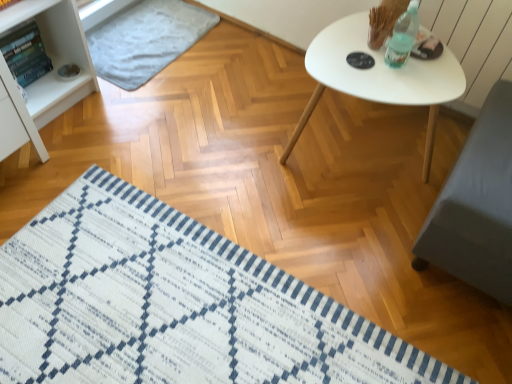
Question: Is white woven mat at lower left, the 2th mat when ordered from top to bottom, positioned behind white matte table at upper right?

Choices:
 (A) yes
 (B) no

Answer: (B)

Question: Can you confirm if white woven mat at lower left, the 2th mat when ordered from top to bottom, is positioned to the right of white matte table at upper right?

Choices:
 (A) no
 (B) yes

Answer: (A)

Question: Does white woven mat at lower left, the 2th mat when ordered from top to bottom, turn towards white matte table at upper right?

Choices:
 (A) yes
 (B) no

Answer: (B)

Question: Would you consider white woven mat at lower left, marked as the 2th mat in a back-to-front arrangement, to be distant from white matte table at upper right?

Choices:
 (A) no
 (B) yes

Answer: (A)

Question: From a real-world perspective, is white woven mat at lower left, the first mat when ordered from front to back, beneath white matte table at upper right?

Choices:
 (A) no
 (B) yes

Answer: (B)

Question: Looking at their shapes, would you say white woven mat at lower left, marked as the 2th mat in a back-to-front arrangement, is wider or thinner than white matte table at upper right?

Choices:
 (A) thin
 (B) wide

Answer: (B)

Question: Is point (308, 307) closer or farther from the camera than point (422, 173)?

Choices:
 (A) farther
 (B) closer

Answer: (B)

Question: From their relative heights in the image, would you say white woven mat at lower left, the first mat when ordered from front to back, is taller or shorter than white matte table at upper right?

Choices:
 (A) tall
 (B) short

Answer: (B)

Question: Considering the positions of white woven mat at lower left, which ranks as the first mat in bottom-to-top order, and white matte table at upper right in the image, is white woven mat at lower left, which ranks as the first mat in bottom-to-top order, bigger or smaller than white matte table at upper right?

Choices:
 (A) big
 (B) small

Answer: (B)

Question: Which is correct: white woven mat at lower left, the 2th mat when ordered from top to bottom, is inside light gray textured mat at upper left, acting as the first mat starting from the back, or outside of it?

Choices:
 (A) outside
 (B) inside

Answer: (A)

Question: Relative to light gray textured mat at upper left, the second mat positioned from the bottom, is white woven mat at lower left, which ranks as the first mat in bottom-to-top order, in front or behind?

Choices:
 (A) behind
 (B) front

Answer: (B)

Question: From a real-world perspective, relative to light gray textured mat at upper left, the second mat positioned from the bottom, is white woven mat at lower left, the first mat when ordered from front to back, vertically above or below?

Choices:
 (A) below
 (B) above

Answer: (A)

Question: From the image's perspective, is white woven mat at lower left, which ranks as the first mat in bottom-to-top order, located above or below light gray textured mat at upper left, the second mat positioned from the bottom?

Choices:
 (A) below
 (B) above

Answer: (A)

Question: From a real-world perspective, is white matte table at upper right positioned above or below white woven mat at lower left, the 2th mat when ordered from top to bottom?

Choices:
 (A) below
 (B) above

Answer: (B)

Question: Considering the positions of white matte table at upper right and white woven mat at lower left, which ranks as the first mat in bottom-to-top order, in the image, is white matte table at upper right wider or thinner than white woven mat at lower left, which ranks as the first mat in bottom-to-top order,?

Choices:
 (A) thin
 (B) wide

Answer: (A)